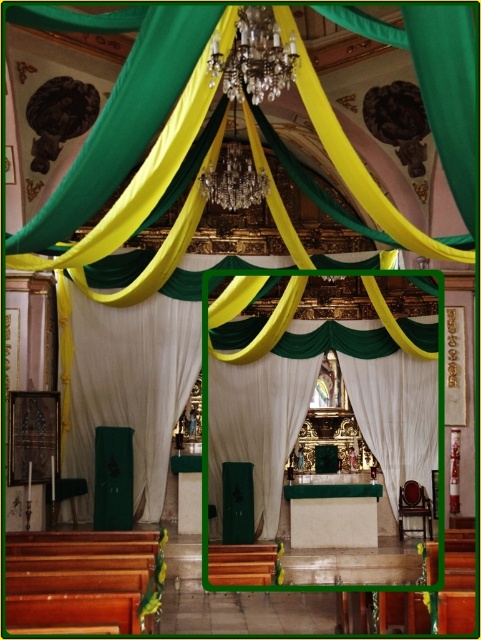
Question: Does white sheer curtain at center have a lesser width compared to white satin curtain at center?

Choices:
 (A) no
 (B) yes

Answer: (A)

Question: Which point is closer to the camera?

Choices:
 (A) white satin curtain at center
 (B) white sheer curtain at center

Answer: (A)

Question: Which point is farther to the camera?

Choices:
 (A) (384, 436)
 (B) (96, 352)

Answer: (B)

Question: Where is white sheer curtain at center located in relation to white satin curtain at center in the image?

Choices:
 (A) left
 (B) right

Answer: (A)

Question: Does white sheer curtain at center have a larger size compared to white satin curtain at center?

Choices:
 (A) yes
 (B) no

Answer: (A)